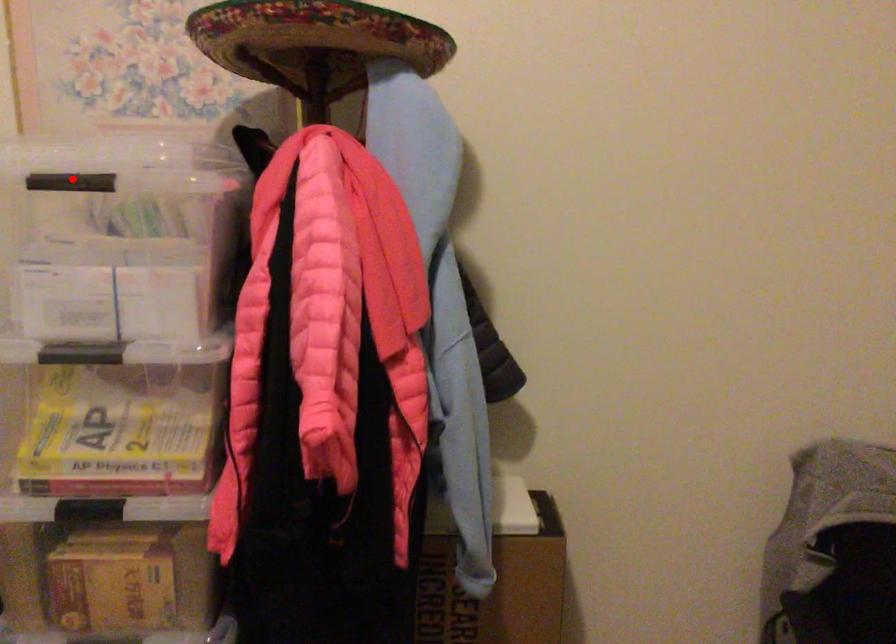
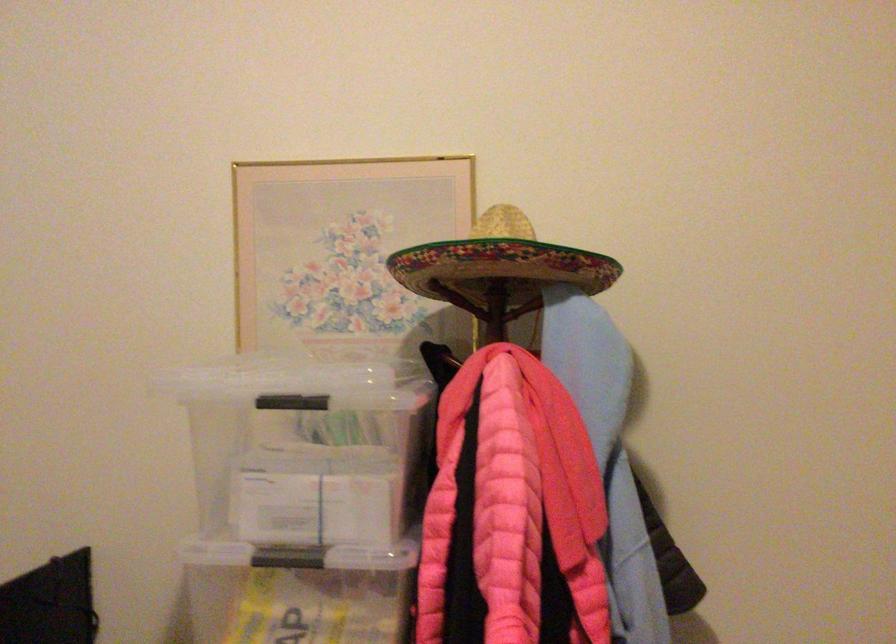
Locate, in the second image, the point that corresponds to the highlighted location in the first image.

(291, 402)